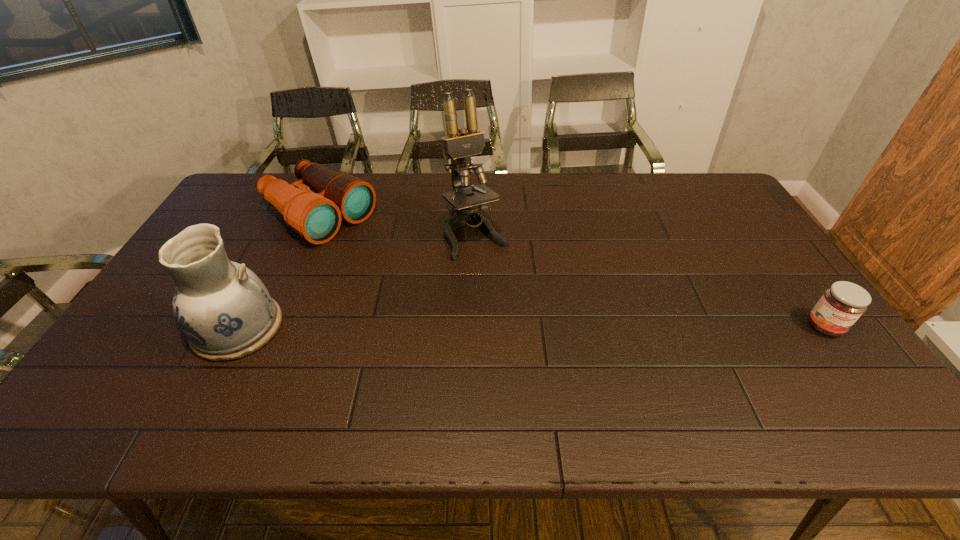
The width and height of the screenshot is (960, 540). In order to click on free space on the desktop that is between the pottery and the rightmost object and is positioned at the eyepieces of the microscope in this screenshot , I will do `click(536, 327)`.

At what (x,y) coordinates should I click in order to perform the action: click on free spot on the desktop that is between the pottery and the shortest object and is positioned through the lenses of the third tallest object. Please return your answer as a coordinate pair (x, y). The height and width of the screenshot is (540, 960). Looking at the image, I should click on (489, 327).